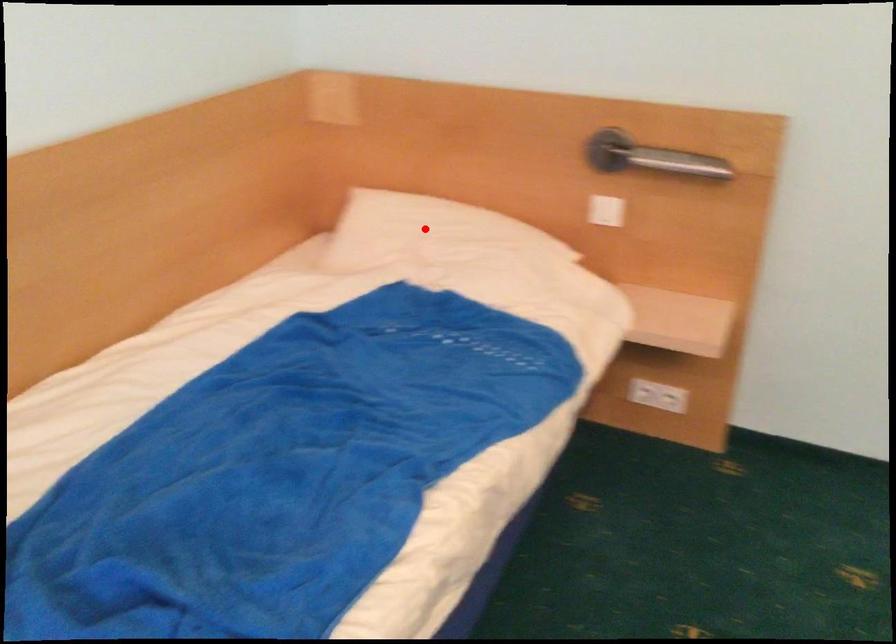
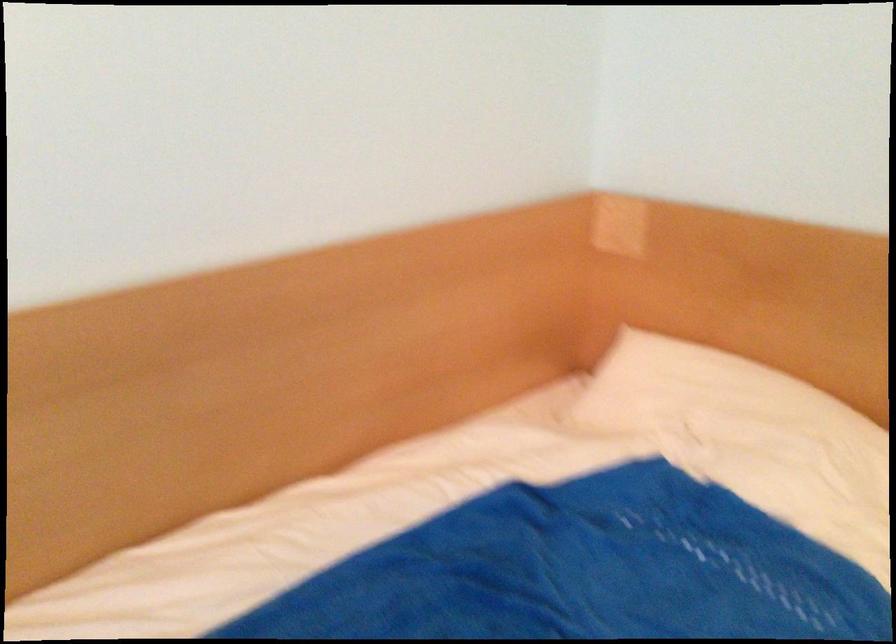
The point at the highlighted location is marked in the first image. Where is the corresponding point in the second image?

(707, 391)